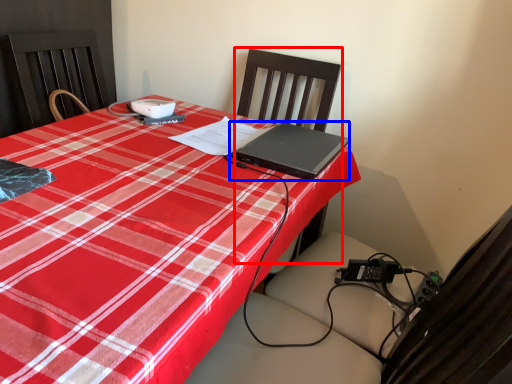
Question: Which object is further to the camera taking this photo, chair (highlighted by a red box) or laptop (highlighted by a blue box)?

Choices:
 (A) chair
 (B) laptop

Answer: (B)